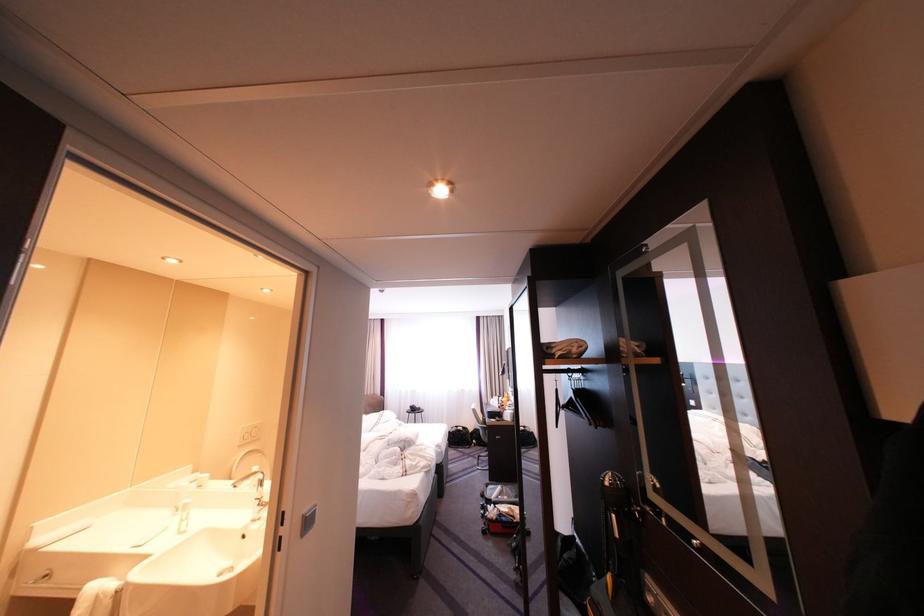
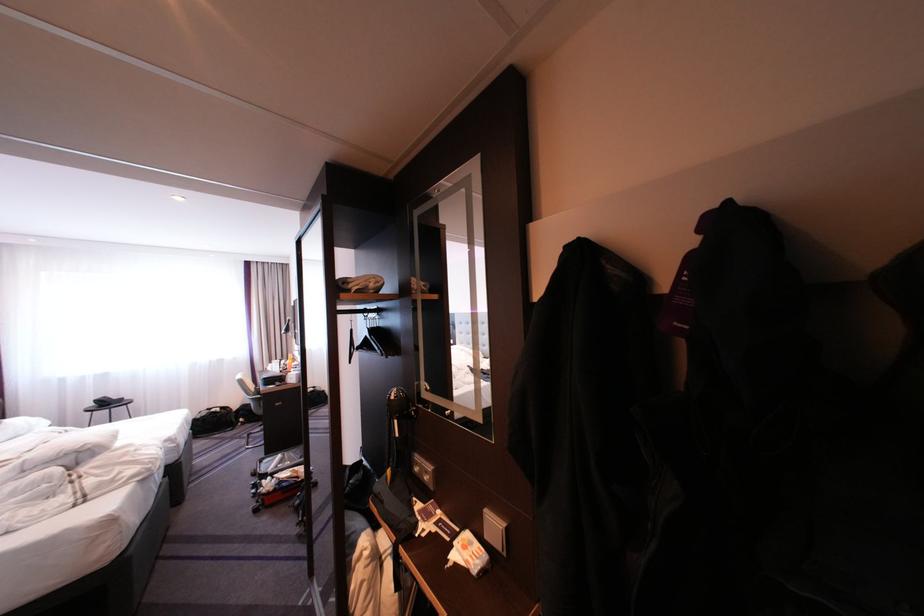
In the second image, find the point that corresponds to point (617, 476) in the first image.

(404, 392)